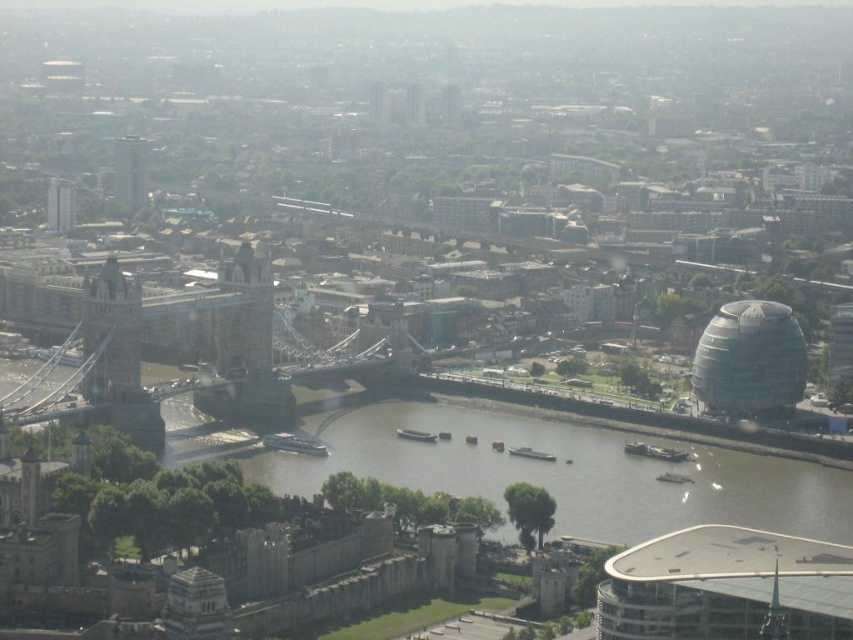
Question: Is white glass dome at right bigger than matte gray building at upper left?

Choices:
 (A) no
 (B) yes

Answer: (B)

Question: Is matte gray bridge at left below matte glass skyscraper at upper left?

Choices:
 (A) yes
 (B) no

Answer: (A)

Question: Which object appears closest to the camera in this image?

Choices:
 (A) brown water at center
 (B) stone bridge at center-left
 (C) matte gray building at upper left

Answer: (A)

Question: Which object is closer to the camera taking this photo?

Choices:
 (A) matte gray bridge at left
 (B) matte glass skyscraper at upper left
 (C) white glass dome at right
 (D) stone bridge at center-left

Answer: (A)

Question: Which of the following is the closest to the observer?

Choices:
 (A) matte gray building at upper left
 (B) brown water at center
 (C) matte gray bridge at left
 (D) stone bridge at center-left

Answer: (B)

Question: Can you confirm if matte gray bridge at left is positioned to the left of matte glass skyscraper at upper left?

Choices:
 (A) yes
 (B) no

Answer: (B)